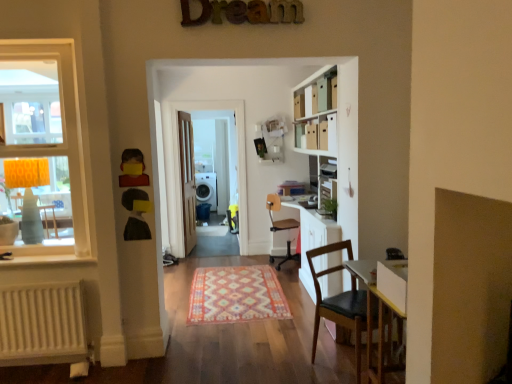
Identify the location of white matte bookcase at center. This screenshot has width=512, height=384. (333, 168).

Measure the distance between brown leather chair at lower right, arranged as the 2th chair when viewed from the back, and camera.

They are 8.41 feet apart.

Describe the element at coordinates (236, 295) in the screenshot. This screenshot has height=384, width=512. I see `multicolored woven rug at center` at that location.

What do you see at coordinates (42, 147) in the screenshot? The image size is (512, 384). I see `matte yellow lampshade at left` at bounding box center [42, 147].

Image resolution: width=512 pixels, height=384 pixels. Identify the location of white matte radiator at lower left. (42, 324).

This screenshot has width=512, height=384. What are the coordinates of `light brown wooden door at center` in the screenshot? It's located at (187, 180).

Image resolution: width=512 pixels, height=384 pixels. I want to click on white matte bookcase at center, so click(333, 168).

Considering the points (303, 238) and (126, 172), which point is in front, point (303, 238) or point (126, 172)?

Positioned in front is point (126, 172).

Based on the photo, is matte yellow toy at left a part of white matte bookcase at center?

No.

Could you tell me if white matte bookcase at center is turned towards matte yellow toy at left?

Yes, white matte bookcase at center is oriented towards matte yellow toy at left.

Locate an element on the screen. This screenshot has height=384, width=512. toy above the white matte bookcase at center (from a real-world perspective) is located at coordinates (132, 164).

You are a GUI agent. You are given a task and a screenshot of the screen. Output one action in this format:
    pyautogui.click(x=<x>, y=<y>)
    Task: Click on the lamp in front of the white plastic speaker at center
    
    Given the screenshot: What is the action you would take?
    pyautogui.click(x=28, y=192)

Do you think orange fabric lampshade at left is within white plastic speaker at center, or outside of it?

orange fabric lampshade at left is outside white plastic speaker at center.

Is orange fabric lampshade at left bigger or smaller than white plastic speaker at center?

Considering their sizes, orange fabric lampshade at left takes up less space than white plastic speaker at center.

Is white plastic speaker at center at the back of orange fabric lampshade at left?

That's not correct — orange fabric lampshade at left is not looking away from white plastic speaker at center.

Is light brown wooden door at center not near matte yellow toy at left?

Yes, light brown wooden door at center and matte yellow toy at left are quite far apart.

Considering the relative sizes of light brown wooden door at center and matte yellow toy at left in the image provided, is light brown wooden door at center taller than matte yellow toy at left?

Indeed, light brown wooden door at center has a greater height compared to matte yellow toy at left.

Is light brown wooden door at center facing towards matte yellow toy at left?

No, light brown wooden door at center is not aimed at matte yellow toy at left.

From the picture: Is white matte radiator at lower left beside white glossy door at center?

No, white matte radiator at lower left is not in contact with white glossy door at center.

Which is more to the left, white matte radiator at lower left or white glossy door at center?

white matte radiator at lower left is more to the left.

Does white matte radiator at lower left have a greater width compared to white glossy door at center?

Yes.

How different are the orientations of white matte radiator at lower left and white glossy door at center in degrees?

The angle between the facing direction of white matte radiator at lower left and the facing direction of white glossy door at center is 0.571 degrees.

Which object is further away from the camera, multicolored woven rug at center or matte yellow lampshade at left?

multicolored woven rug at center is further from the camera.

From a real-world perspective, between multicolored woven rug at center and matte yellow lampshade at left, who is vertically higher?

From a 3D spatial view, matte yellow lampshade at left is above.

Between multicolored woven rug at center and matte yellow lampshade at left, which one has larger width?

multicolored woven rug at center is wider.

From the picture: How different are the orientations of white matte radiator at lower left and orange fabric lampshade at left in degrees?

They differ by 179 degrees in their facing directions.

Considering the relative sizes of white matte radiator at lower left and orange fabric lampshade at left in the image provided, is white matte radiator at lower left smaller than orange fabric lampshade at left?

Correct, white matte radiator at lower left occupies less space than orange fabric lampshade at left.

Consider the image. From a real-world perspective, is white matte radiator at lower left located higher than orange fabric lampshade at left?

Actually, white matte radiator at lower left is physically below orange fabric lampshade at left in the real world.

Looking at this image, which object is wider, white matte radiator at lower left or orange fabric lampshade at left?

orange fabric lampshade at left is wider.

From the image's perspective, which one is positioned lower, white plastic speaker at center or brown leather chair at lower right, the first chair positioned from the front?

From the image's view, brown leather chair at lower right, the first chair positioned from the front, is below.

Looking at this image, is white plastic speaker at center surrounding brown leather chair at lower right, the first chair positioned from the front?

Definitely not — brown leather chair at lower right, the first chair positioned from the front, is not inside white plastic speaker at center.

Which is less distant, (207, 187) or (350, 249)?

The point (350, 249) is closer.

Is white plastic speaker at center positioned with its back to brown leather chair at lower right, the first chair positioned from the front?

No, white plastic speaker at center is not facing the opposite direction of brown leather chair at lower right, the first chair positioned from the front.

The image size is (512, 384). Find the location of `bookcase below the matte yellow toy at left (from the image's perspective)`. bookcase below the matte yellow toy at left (from the image's perspective) is located at coordinates (333, 168).

This screenshot has width=512, height=384. What are the coordinates of `lamp positioned vertically above the white plastic speaker at center (from a real-world perspective)` in the screenshot? It's located at (28, 192).

Based on their spatial positions, is orange fabric lampshade at left or white glossy door at center further from matte yellow toy at left?

Among the two, white glossy door at center is located further to matte yellow toy at left.

When comparing their distances from white matte bookcase at center, does white glossy door at center or orange fabric lampshade at left seem further?

Based on the image, orange fabric lampshade at left appears to be further to white matte bookcase at center.

In the scene shown: Considering their positions, is orange fabric lampshade at left positioned closer to brown leather chair at lower right, arranged as the 2th chair when viewed from the back, than matte yellow toy at left?

matte yellow toy at left lies closer to brown leather chair at lower right, arranged as the 2th chair when viewed from the back, than the other object.

From the image, which object appears to be nearer to white matte bookcase at center, light brown wooden door at center or white glossy door at center?

The object closer to white matte bookcase at center is white glossy door at center.

When comparing their distances from brown leather chair at lower right, arranged as the 2th chair when viewed from the back, does wooden at center, the first chair in the back-to-front sequence, or white matte bookcase at center seem closer?

white matte bookcase at center.

Looking at the image, which one is located closer to brown leather chair at lower right, arranged as the 2th chair when viewed from the back, white plastic speaker at center or matte yellow lampshade at left?

Among the two, matte yellow lampshade at left is located nearer to brown leather chair at lower right, arranged as the 2th chair when viewed from the back.

Based on the photo, which object lies further to the anchor point white glossy door at center, brown leather chair at lower right, arranged as the 2th chair when viewed from the back, or white matte bookcase at center?

Based on the image, brown leather chair at lower right, arranged as the 2th chair when viewed from the back, appears to be further to white glossy door at center.

Considering their positions, is brown leather chair at lower right, the first chair positioned from the front, positioned further to multicolored woven rug at center than white matte bookcase at center?

Among the two, white matte bookcase at center is located further to multicolored woven rug at center.

Locate an element on the screen. This screenshot has height=384, width=512. bookcase positioned between orange fabric lampshade at left and light brown wooden door at center from near to far is located at coordinates (333, 168).

Identify the location of mat positioned between white matte radiator at lower left and white plastic speaker at center from near to far. (236, 295).

This screenshot has height=384, width=512. I want to click on radiator located between matte yellow lampshade at left and white glossy door at center in the depth direction, so click(x=42, y=324).

Where is `door between wooden at center, which ranks as the second chair in front-to-back order, and white plastic speaker at center, along the z-axis`? door between wooden at center, which ranks as the second chair in front-to-back order, and white plastic speaker at center, along the z-axis is located at coordinates (187, 180).